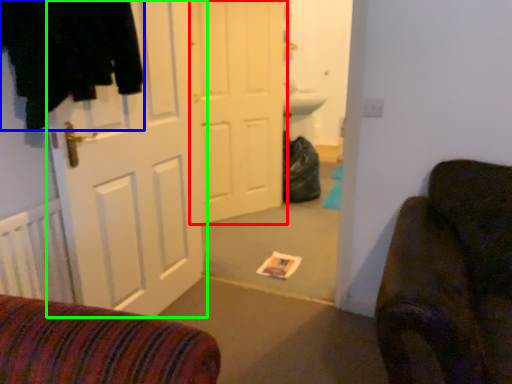
Question: Which object is positioned farthest from door (highlighted by a red box)? Select from clothing (highlighted by a blue box) and door (highlighted by a green box).

Choices:
 (A) clothing
 (B) door

Answer: (A)